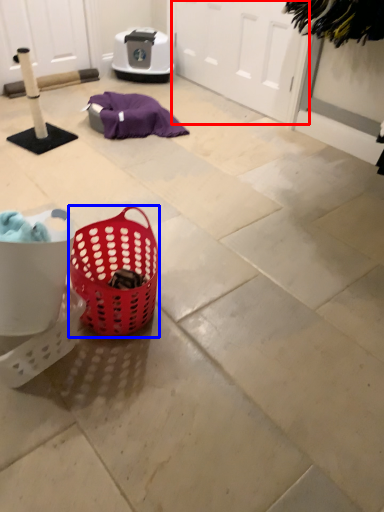
Question: Among these objects, which one is nearest to the camera, screen door (highlighted by a red box) or picnic basket (highlighted by a blue box)?

Choices:
 (A) screen door
 (B) picnic basket

Answer: (B)